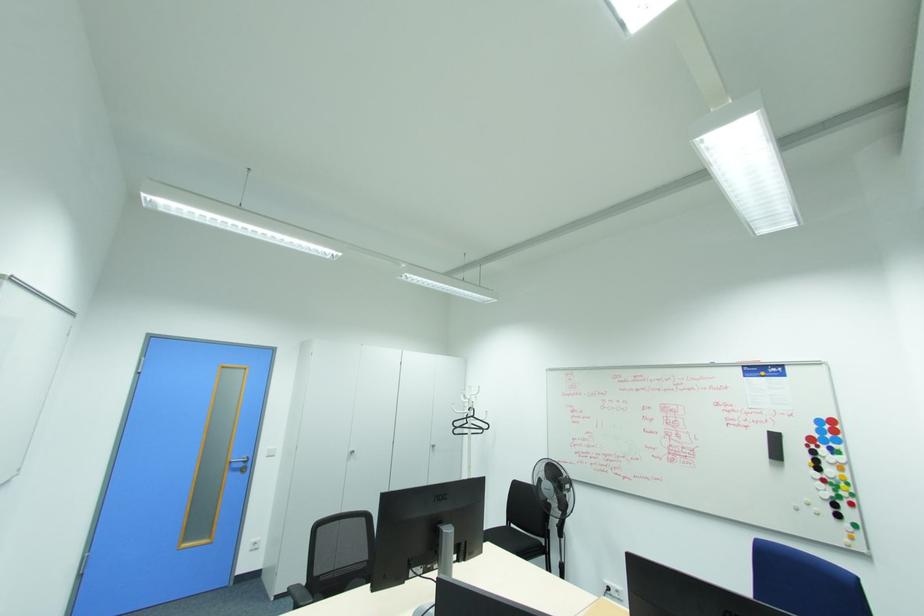
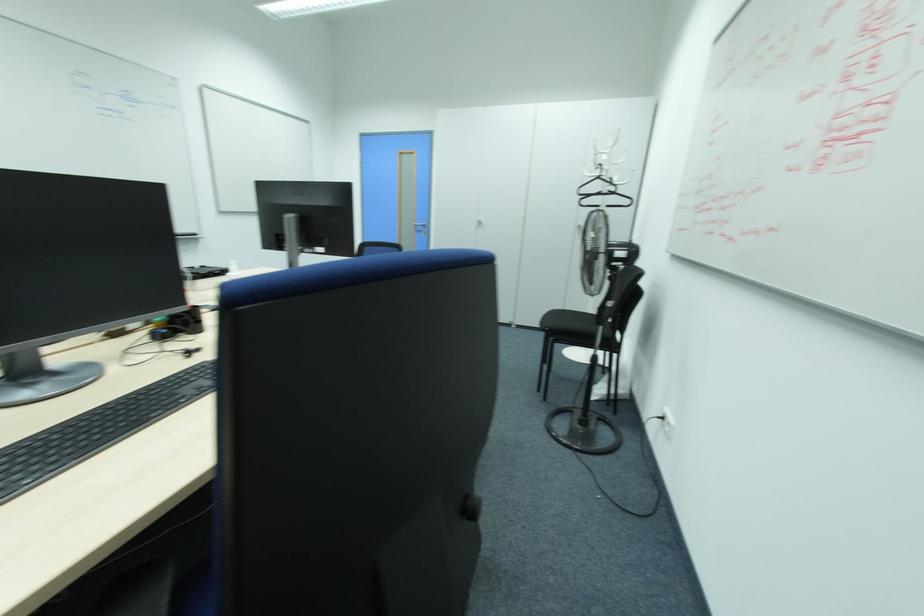
Find the pixel in the second image that matches (x=349, y=459) in the first image.

(479, 227)